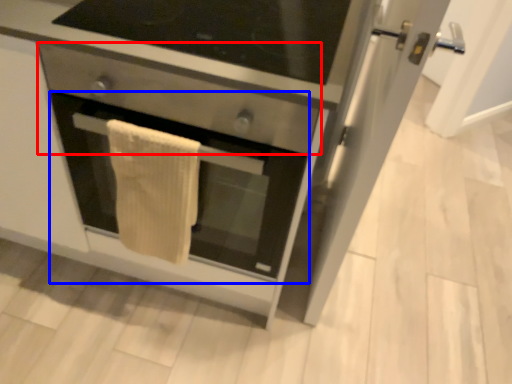
Question: Which of the following is the farthest to the observer, drawer (highlighted by a red box) or oven (highlighted by a blue box)?

Choices:
 (A) drawer
 (B) oven

Answer: (B)